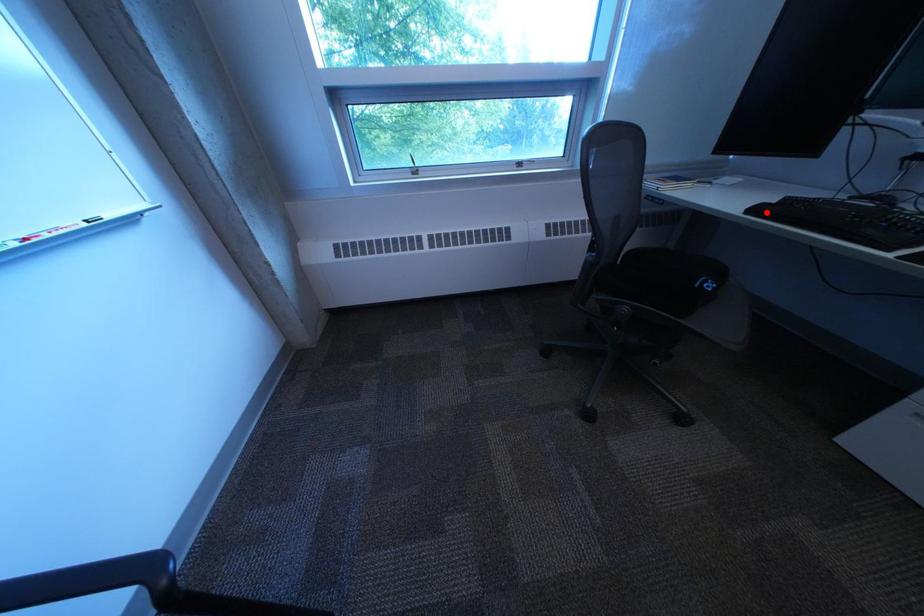
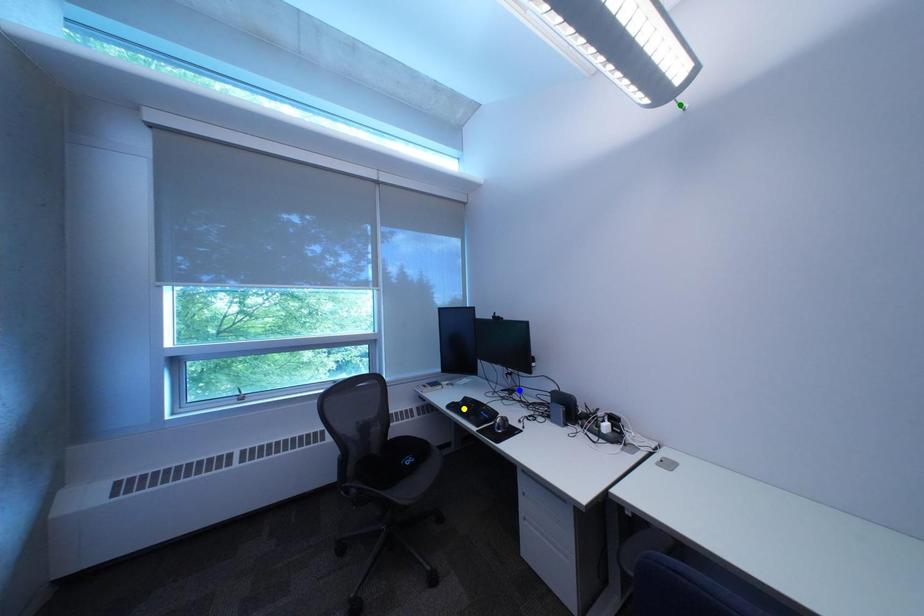
Question: I am providing you with two images of the same scene from different viewpoints. A red point is marked on the first image. You are given multiple points on the second image. Can you choose the point in image 2 that corresponds to the point in image 1?

Choices:
 (A) yellow point
 (B) blue point
 (C) green point

Answer: (A)